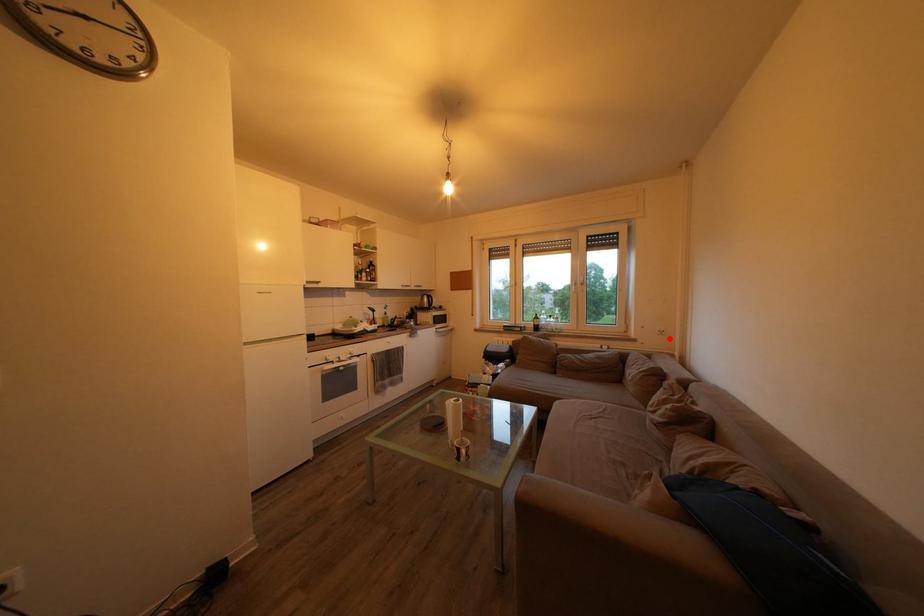
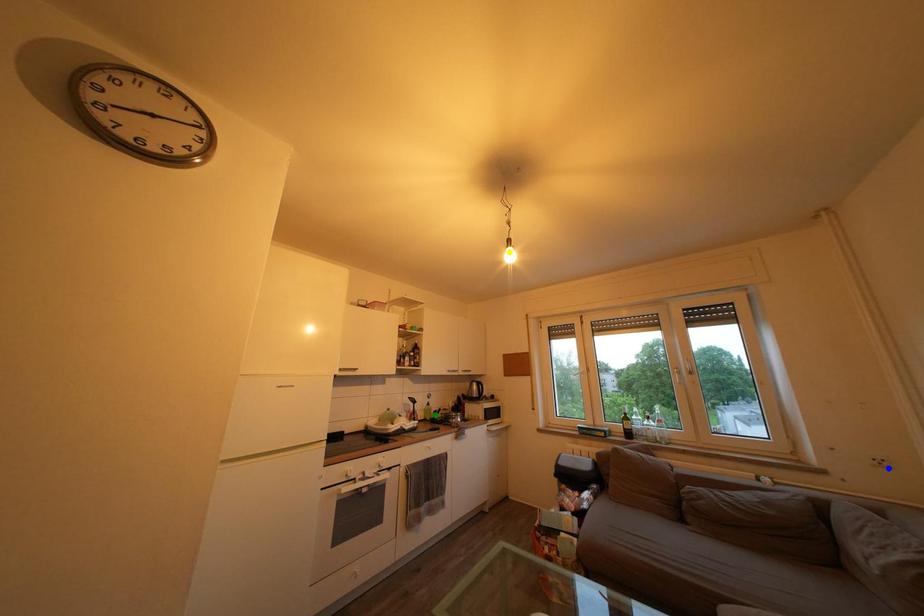
Question: I am providing you with two images of the same scene from different viewpoints. A red point is marked on the first image. You are given multiple points on the second image. Which mark in image 2 goes with the point in image 1?

Choices:
 (A) blue point
 (B) green point
 (C) yellow point

Answer: (A)